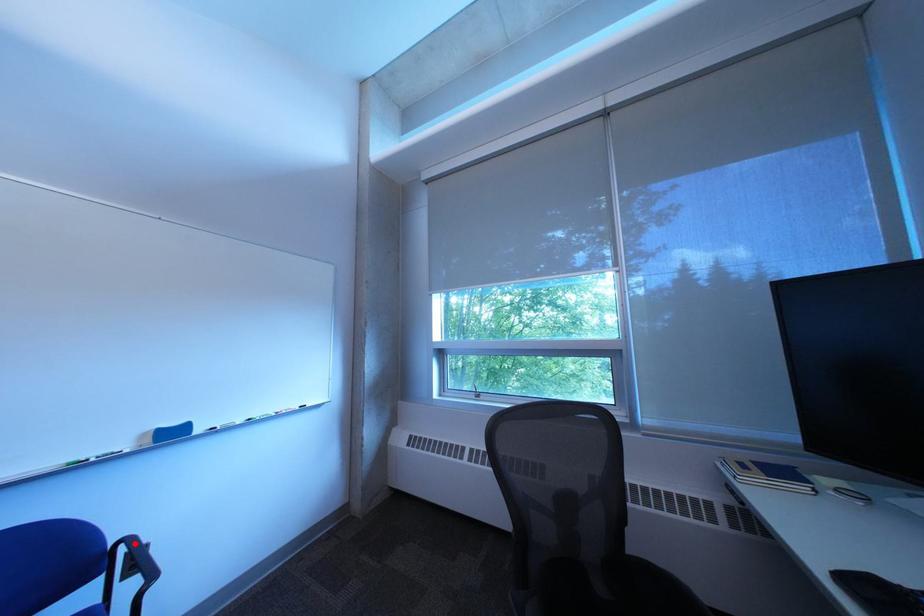
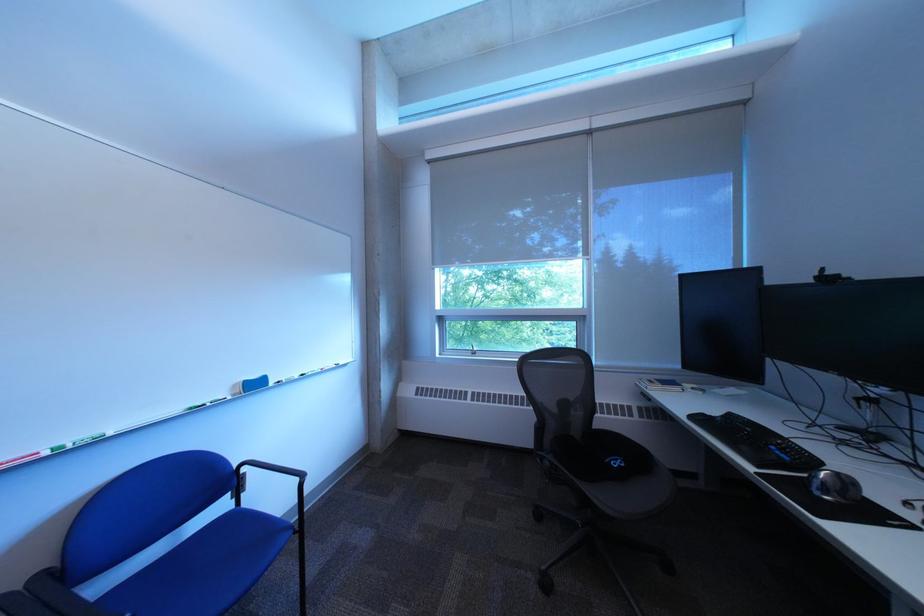
Question: I am providing you with two images of the same scene from different viewpoints. Image1 has a red point marked. In image2, the corresponding 3D location appears at what relative position? Reply with the corresponding letter.

Choices:
 (A) Closer
 (B) Farther

Answer: (B)